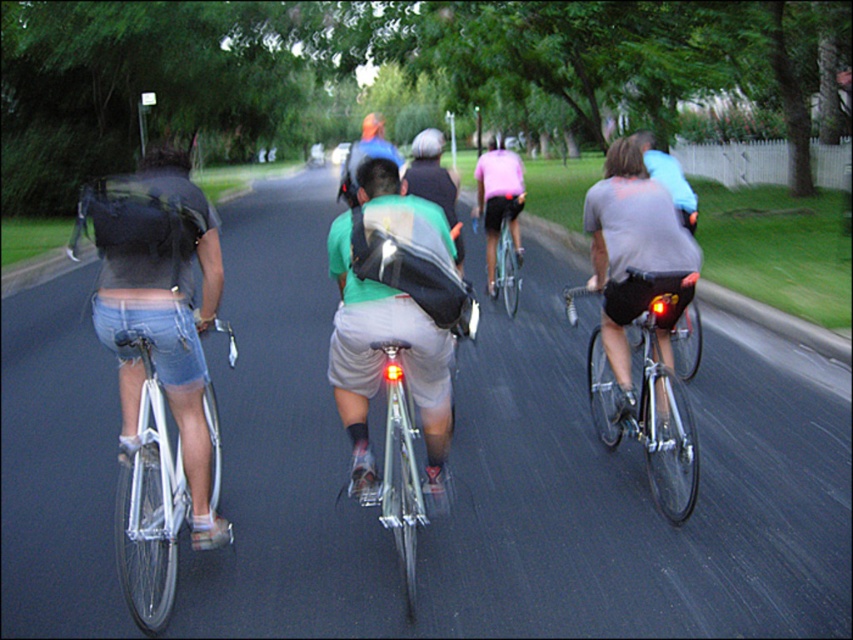
Question: Considering the real-world distances, which object is farthest from the shiny silver bicycle at center?

Choices:
 (A) shiny blue bicycle at center
 (B) shiny black bicycle at center
 (C) silver metallic bicycle at left

Answer: (A)

Question: Considering the real-world distances, which object is closest to the silver metallic bicycle at left?

Choices:
 (A) green fabric shirt at center
 (B) shiny black bicycle at center

Answer: (A)

Question: Which object is the closest to the green fabric shirt at center?

Choices:
 (A) silver metallic bicycle at left
 (B) shiny silver bicycle at center
 (C) shiny black bicycle at center
 (D) shiny blue bicycle at center

Answer: (B)

Question: Is shiny silver bicycle at center below shiny blue bicycle at center?

Choices:
 (A) yes
 (B) no

Answer: (A)

Question: Is green fabric shirt at center thinner than shiny black bicycle at center?

Choices:
 (A) yes
 (B) no

Answer: (B)

Question: Is silver metallic bicycle at left to the right of shiny blue bicycle at center from the viewer's perspective?

Choices:
 (A) yes
 (B) no

Answer: (B)